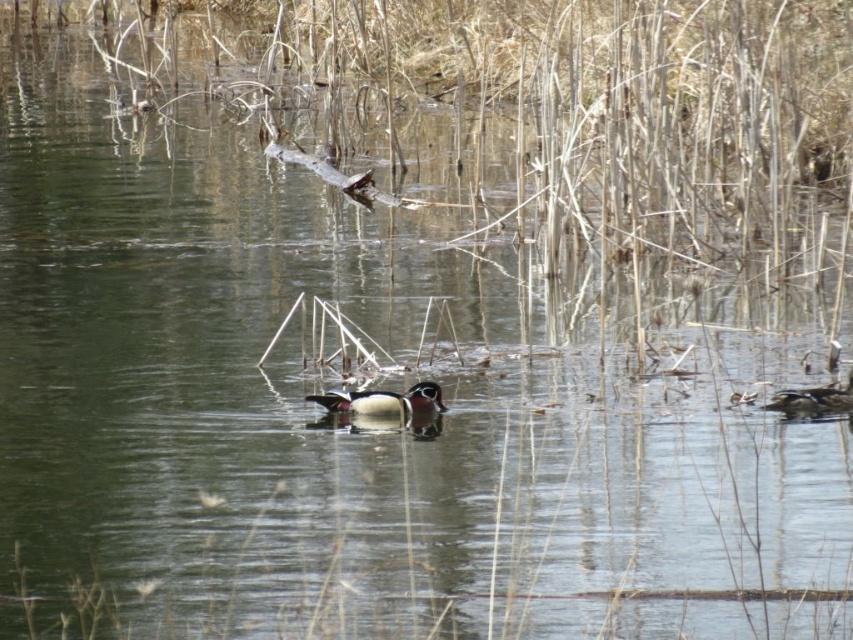
You are a wildlife photographer aiming to capture both the wood grain duck at center and the shiny brown duck at right in a single frame. Given their sizes, which duck will appear bigger in your photo?

The wood grain duck at center will appear bigger in the photo because it has a larger size compared to the shiny brown duck at right.

You are a wildlife photographer aiming to capture both the wood grain duck at center and the shiny brown duck at right in a single frame. Based on their positions and sizes, can you fit both ducks into your camera viewfinder without zooming in?

The wood grain duck at center might be wider than shiny brown duck at right, so it is possible to fit both into the viewfinder as long as their combined width does not exceed the viewfinder limits.

You are standing at the edge of the water and want to take a photo of the wood grain duck at center. If you move 0.1 units to the right along the x axis, will the duck still be in the center of your photo?

The wood grain duck at center is located at point (384, 401). Moving 0.1 units to the right along the x axis would shift your position, but the duck remains at its original position. Therefore, the duck will still be in the center of your photo.